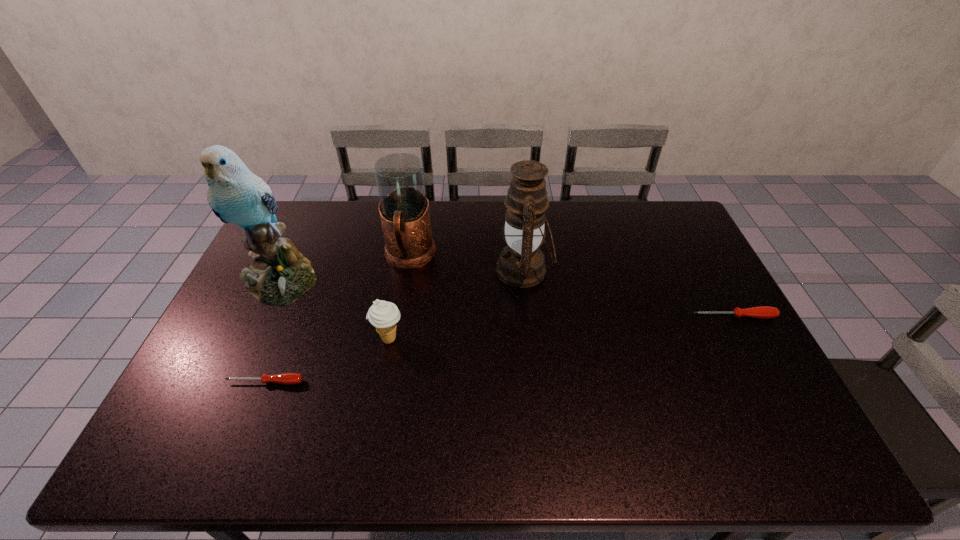
At what (x,y) coordinates should I click in order to perform the action: click on free space between the pitcher and the icecream. Please return your answer as a coordinate pair (x, y). This screenshot has width=960, height=540. Looking at the image, I should click on (399, 298).

Image resolution: width=960 pixels, height=540 pixels. Identify the location of free space that is in between the oil lamp and the parakeet. (402, 274).

You are a GUI agent. You are given a task and a screenshot of the screen. Output one action in this format:
    pyautogui.click(x=<x>, y=<y>)
    Task: Click on the free spot between the pitcher and the nearest object
    The width and height of the screenshot is (960, 540).
    Given the screenshot: What is the action you would take?
    pyautogui.click(x=337, y=320)

Locate an element on the screen. The width and height of the screenshot is (960, 540). free space between the nearest object and the tallest object is located at coordinates (273, 330).

Image resolution: width=960 pixels, height=540 pixels. In order to click on vacant point located between the parakeet and the taller screwdriver in this screenshot , I will do `click(507, 298)`.

You are a GUI agent. You are given a task and a screenshot of the screen. Output one action in this format:
    pyautogui.click(x=<x>, y=<y>)
    Task: Click on the vacant region between the oil lamp and the pitcher
    
    Given the screenshot: What is the action you would take?
    pyautogui.click(x=467, y=264)

Locate an element on the screen. Image resolution: width=960 pixels, height=540 pixels. free space between the oil lamp and the pitcher is located at coordinates (467, 264).

Find the location of `unoccupied area between the right screwdriver and the icecream`. unoccupied area between the right screwdriver and the icecream is located at coordinates 561,328.

This screenshot has width=960, height=540. I want to click on blank region between the icecream and the left screwdriver, so click(327, 360).

Identify which object is the closest to the nearest object. Please provide its 2D coordinates. Your answer should be formatted as a tuple, i.e. [(x, y)], where the tuple contains the x and y coordinates of a point satisfying the conditions above.

[(383, 315)]